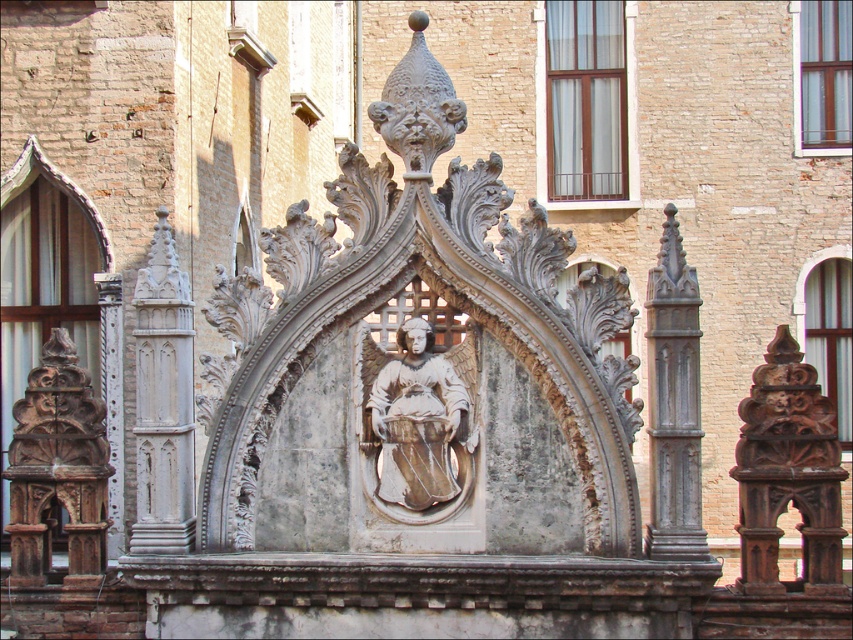
You are an architect analyzing the layout of this historical structure. You need to determine the exact 2D coordinates of the white stone column at left for your design plans. What are its coordinates?

The white stone column at left is located at the 2D coordinates of point (163, 401).

You are an architect examining the stone structure. You notice the white stone sculpture at center and the carved wood column at left. Which object is positioned higher in the image?

The white stone sculpture at center is above the carved wood column at left, so it is positioned higher in the image.

You are an art conservator examining the stone structure. You need to assess the placement of the white stone sculpture at center and the white stone angel at center. Which one is positioned higher in the structure?

The white stone sculpture at center is located above the white stone angel at center, so it is positioned higher in the structure.